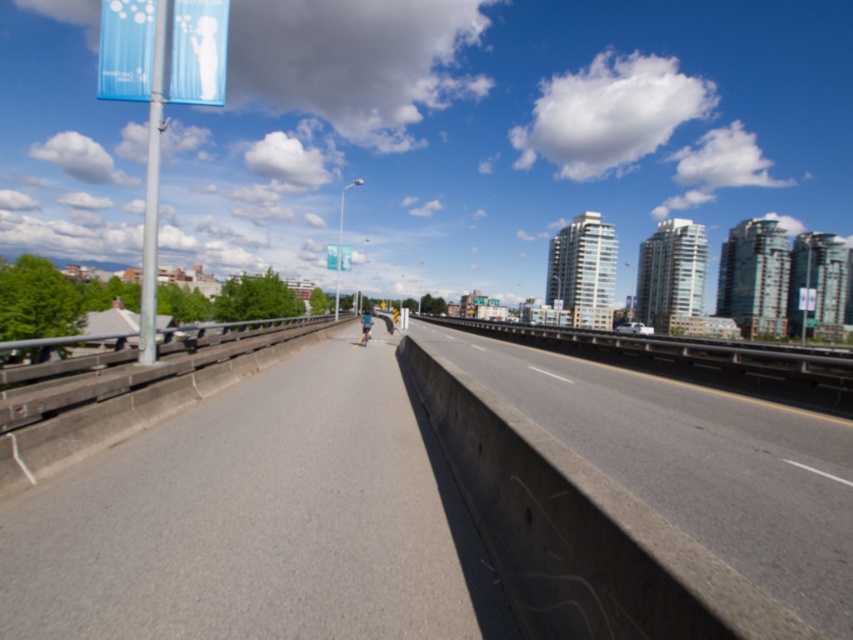
Between gray asphalt highway at center and white plastic traffic sign at center, which one has more height?

With more height is white plastic traffic sign at center.

Who is more distant from viewer, [267,602] or [341,260]?

Positioned behind is point [341,260].

What are the coordinates of `gray asphalt highway at center` in the screenshot? It's located at (259, 520).

Can you confirm if concrete at center is thinner than white plastic traffic sign at center?

Incorrect, concrete at center's width is not less than white plastic traffic sign at center's.

Does concrete at center have a greater height compared to white plastic traffic sign at center?

No, concrete at center is not taller than white plastic traffic sign at center.

Is point (639, 420) closer to camera compared to point (340, 266)?

Yes, point (639, 420) is closer to viewer.

I want to click on concrete at center, so click(x=695, y=461).

The image size is (853, 640). Describe the element at coordinates (259, 520) in the screenshot. I see `gray asphalt highway at center` at that location.

Is gray asphalt highway at center smaller than concrete at center?

Correct, gray asphalt highway at center occupies less space than concrete at center.

Between point (289, 634) and point (674, 504), which one is positioned in front?

Point (289, 634)

The image size is (853, 640). Find the location of `gray asphalt highway at center`. gray asphalt highway at center is located at coordinates (259, 520).